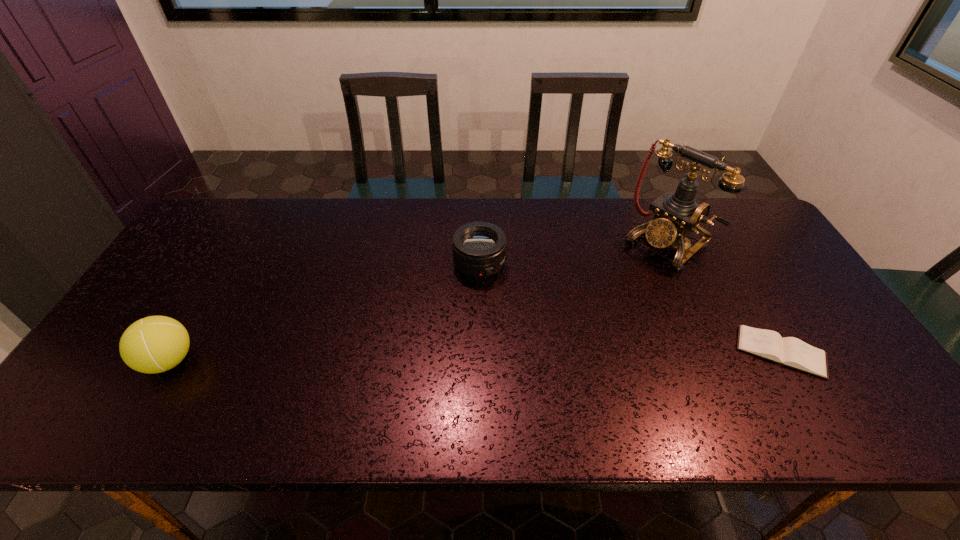
Where is `vacant space located on the front of the tallest object, featuring the rotary dial`? The height and width of the screenshot is (540, 960). vacant space located on the front of the tallest object, featuring the rotary dial is located at coordinates click(x=574, y=320).

At what (x,y) coordinates should I click in order to perform the action: click on vacant position located 0.220m on the side of the third tallest object with brand markings and control switches. Please return your answer as a coordinate pair (x, y). Looking at the image, I should click on (538, 334).

Identify the location of vacant space situated on the side of the third tallest object with brand markings and control switches. This screenshot has height=540, width=960. (556, 357).

Find the location of `vacant position located on the side of the third tallest object with brand markings and control switches`. vacant position located on the side of the third tallest object with brand markings and control switches is located at coordinates (510, 301).

Find the location of `object present at the far edge`. object present at the far edge is located at coordinates (677, 214).

At what (x,y) coordinates should I click in order to perform the action: click on tennis ball that is positioned at the near edge. Please return your answer as a coordinate pair (x, y). Looking at the image, I should click on (154, 344).

Identify the location of diary at the near edge. (789, 351).

Find the location of a particular element. This screenshot has width=960, height=540. object that is at the left edge is located at coordinates (154, 344).

Find the location of a particular element. This screenshot has width=960, height=540. object located in the right edge section of the desktop is located at coordinates (789, 351).

Where is `object that is at the near left corner`? Image resolution: width=960 pixels, height=540 pixels. object that is at the near left corner is located at coordinates (154, 344).